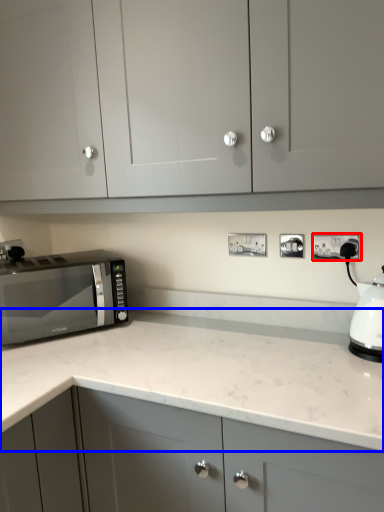
Question: Which object is closer to the camera taking this photo, electric outlet (highlighted by a red box) or countertop (highlighted by a blue box)?

Choices:
 (A) electric outlet
 (B) countertop

Answer: (B)